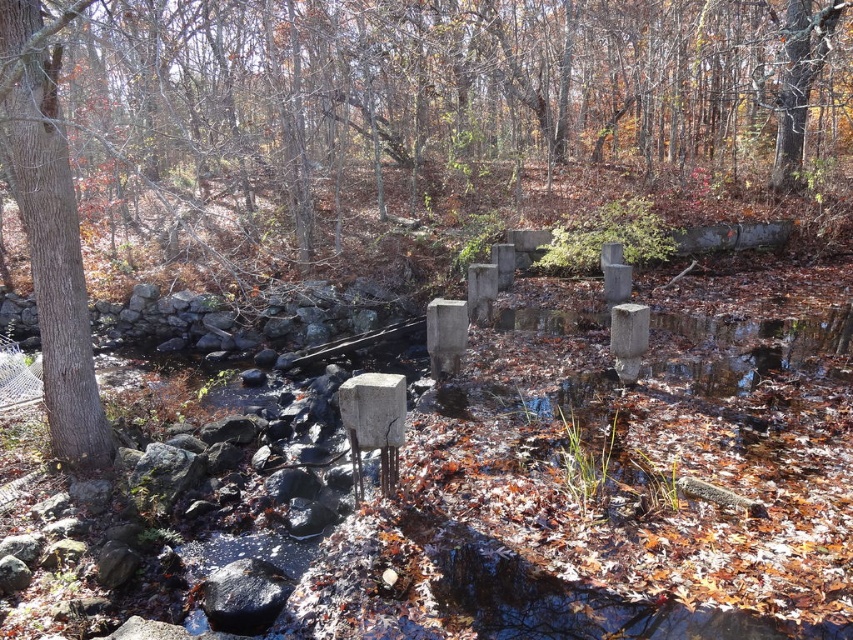
Locate an element on the screen. Image resolution: width=853 pixels, height=640 pixels. brown rough tree at left is located at coordinates (50, 228).

Can you confirm if brown rough tree at left is wider than black smooth rock at lower left?

Indeed, brown rough tree at left has a greater width compared to black smooth rock at lower left.

Between point (67, 403) and point (222, 589), which one is positioned behind?

The point (67, 403) is more distant.

This screenshot has width=853, height=640. I want to click on brown rough tree at left, so click(50, 228).

Can you confirm if brown rough tree trunk at center-left is positioned to the right of brown rough tree at left?

Indeed, brown rough tree trunk at center-left is positioned on the right side of brown rough tree at left.

Measure the distance from brown rough tree trunk at center-left to brown rough tree at left.

11.74 meters

This screenshot has width=853, height=640. Describe the element at coordinates (392, 131) in the screenshot. I see `brown rough tree trunk at center-left` at that location.

Where is `brown rough tree trunk at center-left`? The width and height of the screenshot is (853, 640). brown rough tree trunk at center-left is located at coordinates (392, 131).

Looking at this image, does brown rough tree trunk at center-left have a smaller size compared to black smooth rock at lower left?

No, brown rough tree trunk at center-left is not smaller than black smooth rock at lower left.

You are a GUI agent. You are given a task and a screenshot of the screen. Output one action in this format:
    pyautogui.click(x=<x>, y=<y>)
    Task: Click on the brown rough tree trunk at center-left
    The width and height of the screenshot is (853, 640).
    Given the screenshot: What is the action you would take?
    pyautogui.click(x=392, y=131)

The width and height of the screenshot is (853, 640). I want to click on brown rough tree trunk at center-left, so click(x=392, y=131).